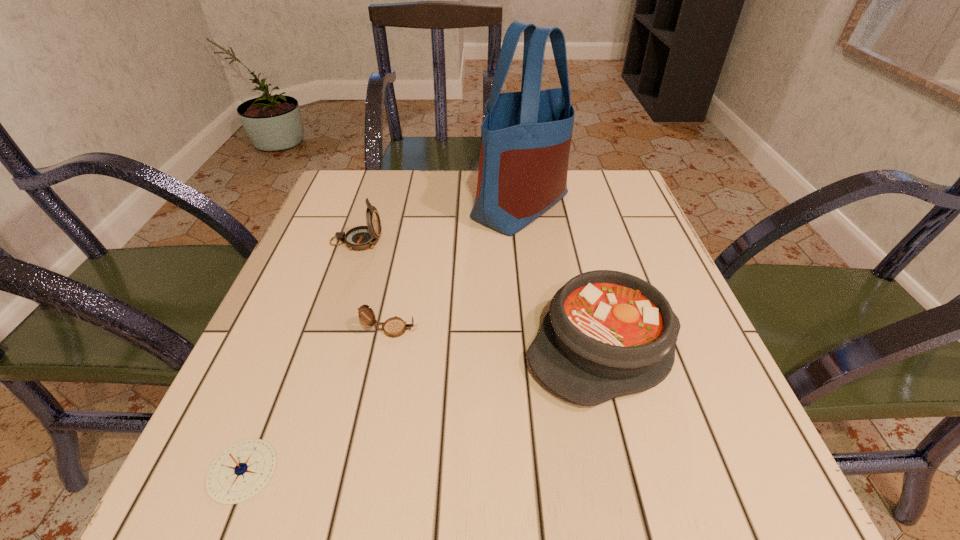
The width and height of the screenshot is (960, 540). I want to click on blank area in the image that satisfies the following two spatial constraints: 1. on the face of the casserole; 2. on the right side of the tallest compass, so (321, 347).

You are a GUI agent. You are given a task and a screenshot of the screen. Output one action in this format:
    pyautogui.click(x=<x>, y=<y>)
    Task: Click on the vacant space that satisfies the following two spatial constraints: 1. on the face of the casserole; 2. on the left side of the farthest compass
    
    Given the screenshot: What is the action you would take?
    pyautogui.click(x=321, y=347)

Locate an element on the screen. free point that satisfies the following two spatial constraints: 1. on the face of the casserole; 2. on the right side of the tallest compass is located at coordinates (321, 347).

Locate an element on the screen. free region that satisfies the following two spatial constraints: 1. on the face of the rightmost compass; 2. on the front side of the nearest object is located at coordinates (362, 471).